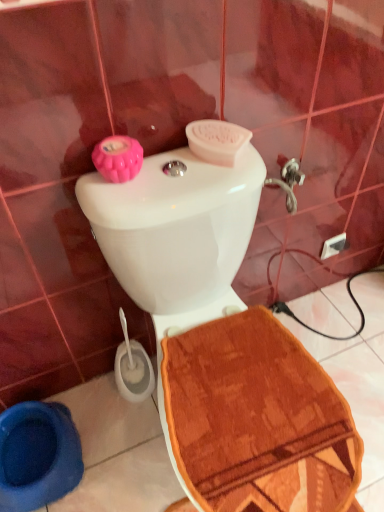
This screenshot has width=384, height=512. What do you see at coordinates (222, 341) in the screenshot? I see `white glossy toilet at center` at bounding box center [222, 341].

Find the location of a particular element. The image size is (384, 512). white glossy toilet at center is located at coordinates (222, 341).

Image resolution: width=384 pixels, height=512 pixels. Describe the element at coordinates (37, 455) in the screenshot. I see `blue rubber toilet bowl at lower left` at that location.

In order to face blue rubber toilet bowl at lower left, should I rotate leftwards or rightwards?

You should look left and rotate roughly 20.417 degrees.

This screenshot has height=512, width=384. Find the location of `blue rubber toilet bowl at lower left`. blue rubber toilet bowl at lower left is located at coordinates (37, 455).

Identify the location of white glossy toilet at center. The height and width of the screenshot is (512, 384). (222, 341).

Based on their positions, is white glossy toilet at center located to the left or right of blue rubber toilet bowl at lower left?

white glossy toilet at center is positioned on blue rubber toilet bowl at lower left's right side.

Which object is closer to the camera taking this photo, white glossy toilet at center or blue rubber toilet bowl at lower left?

white glossy toilet at center.

Is point (127, 246) less distant than point (36, 487)?

Yes, point (127, 246) is closer to viewer.

From the image's perspective, would you say white glossy toilet at center is positioned over blue rubber toilet bowl at lower left?

Correct, white glossy toilet at center appears higher than blue rubber toilet bowl at lower left in the image.

From a real-world perspective, who is located lower, white glossy toilet at center or blue rubber toilet bowl at lower left?

From a 3D spatial view, blue rubber toilet bowl at lower left is below.

Can you confirm if white glossy toilet at center is wider than blue rubber toilet bowl at lower left?

Indeed, white glossy toilet at center has a greater width compared to blue rubber toilet bowl at lower left.

Between white glossy toilet at center and blue rubber toilet bowl at lower left, which one has more height?

white glossy toilet at center.

Is white glossy toilet at center bigger than blue rubber toilet bowl at lower left?

Yes, white glossy toilet at center is bigger than blue rubber toilet bowl at lower left.

Would you say white glossy toilet at center contains blue rubber toilet bowl at lower left?

That's incorrect, blue rubber toilet bowl at lower left is not inside white glossy toilet at center.

Based on the photo, are white glossy toilet at center and blue rubber toilet bowl at lower left located far from each other?

No, white glossy toilet at center is not far from blue rubber toilet bowl at lower left.

Is white glossy toilet at center facing away from blue rubber toilet bowl at lower left?

No, white glossy toilet at center is not facing the opposite direction of blue rubber toilet bowl at lower left.

In the image, there is a white glossy toilet at center. Where is `toilet bowl below it (from the image's perspective)`? This screenshot has height=512, width=384. toilet bowl below it (from the image's perspective) is located at coordinates (37, 455).

Does blue rubber toilet bowl at lower left appear on the left side of white glossy toilet at center?

Yes.

Based on the photo, considering their positions, is blue rubber toilet bowl at lower left located in front of or behind white glossy toilet at center?

In the image, blue rubber toilet bowl at lower left appears behind white glossy toilet at center.

Considering the points (13, 440) and (189, 301), which point is behind, point (13, 440) or point (189, 301)?

The point (13, 440) is farther.

From the image's perspective, is blue rubber toilet bowl at lower left above or below white glossy toilet at center?

blue rubber toilet bowl at lower left is below white glossy toilet at center.

From a real-world perspective, is blue rubber toilet bowl at lower left physically located above or below white glossy toilet at center?

Clearly, from a real-world perspective, blue rubber toilet bowl at lower left is below white glossy toilet at center.

Is blue rubber toilet bowl at lower left wider or thinner than white glossy toilet at center?

blue rubber toilet bowl at lower left is thinner than white glossy toilet at center.

Is blue rubber toilet bowl at lower left taller than white glossy toilet at center?

In fact, blue rubber toilet bowl at lower left may be shorter than white glossy toilet at center.

Between blue rubber toilet bowl at lower left and white glossy toilet at center, which one has smaller size?

Smaller between the two is blue rubber toilet bowl at lower left.

Would you say blue rubber toilet bowl at lower left is inside or outside white glossy toilet at center?

blue rubber toilet bowl at lower left is located beyond the bounds of white glossy toilet at center.

Is blue rubber toilet bowl at lower left next to white glossy toilet at center?

No, blue rubber toilet bowl at lower left is not with white glossy toilet at center.

Is blue rubber toilet bowl at lower left oriented towards white glossy toilet at center?

No, blue rubber toilet bowl at lower left does not turn towards white glossy toilet at center.

Can you tell me how much blue rubber toilet bowl at lower left and white glossy toilet at center differ in facing direction?

0.214 degrees separate the facing orientations of blue rubber toilet bowl at lower left and white glossy toilet at center.

This screenshot has width=384, height=512. I want to click on toilet on the right of blue rubber toilet bowl at lower left, so click(x=222, y=341).

Where is `toilet bowl on the left of white glossy toilet at center`? The image size is (384, 512). toilet bowl on the left of white glossy toilet at center is located at coordinates (37, 455).

Where is `toilet bowl behind the white glossy toilet at center`? This screenshot has width=384, height=512. toilet bowl behind the white glossy toilet at center is located at coordinates (37, 455).